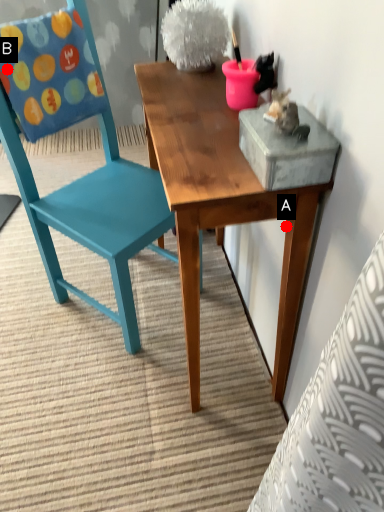
Question: Two points are circled on the image, labeled by A and B beside each circle. Which point is closer to the camera?

Choices:
 (A) A is closer
 (B) B is closer

Answer: (A)